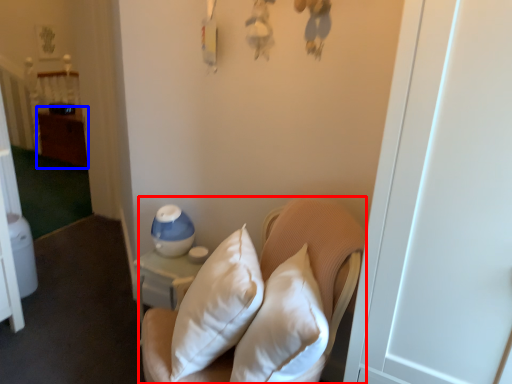
Question: Which object is further to the camera taking this photo, furniture (highlighted by a red box) or dresser (highlighted by a blue box)?

Choices:
 (A) furniture
 (B) dresser

Answer: (B)